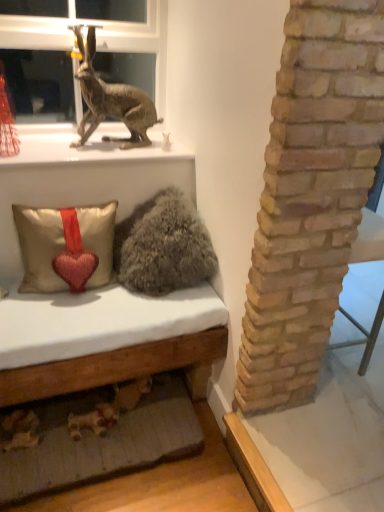
What are the coordinates of `vacant space in satin beige pillow with heart at lower left (from a real-world perspective)` in the screenshot? It's located at (62, 294).